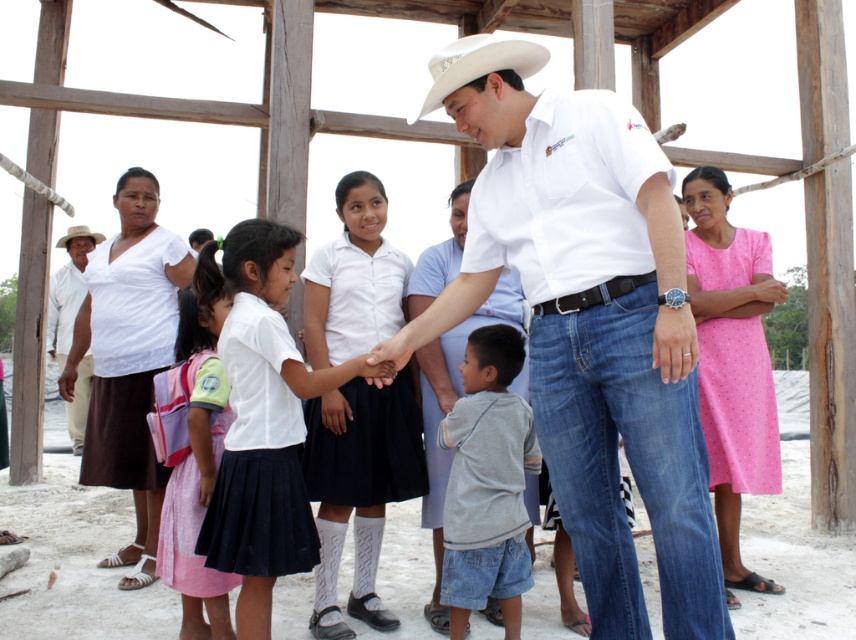
Is white cotton shirt at center in front of white felt cowboy hat at upper left?

That is True.

Can you confirm if white cotton shirt at center is bigger than white felt cowboy hat at upper left?

Yes, white cotton shirt at center is bigger than white felt cowboy hat at upper left.

Which is in front, point (525, 378) or point (75, 225)?

Point (525, 378) is in front.

The width and height of the screenshot is (856, 640). In order to click on white cotton shirt at center in this screenshot , I will do `click(449, 410)`.

Between white cotton shirt at center and white felt cowboy hat at center, which one appears on the left side from the viewer's perspective?

Positioned to the left is white felt cowboy hat at center.

Looking at this image, does white cotton shirt at center lie in front of white felt cowboy hat at center?

No, it is not.

Is point (438, 387) in front of point (506, 77)?

No, it is behind (506, 77).

This screenshot has height=640, width=856. In order to click on white cotton shirt at center in this screenshot , I will do `click(449, 410)`.

Does gray cotton shirt at center have a greater width compared to white felt cowboy hat at center?

No, gray cotton shirt at center is not wider than white felt cowboy hat at center.

At what (x,y) coordinates should I click in order to perform the action: click on gray cotton shirt at center. Please return your answer as a coordinate pair (x, y). Looking at the image, I should click on (486, 483).